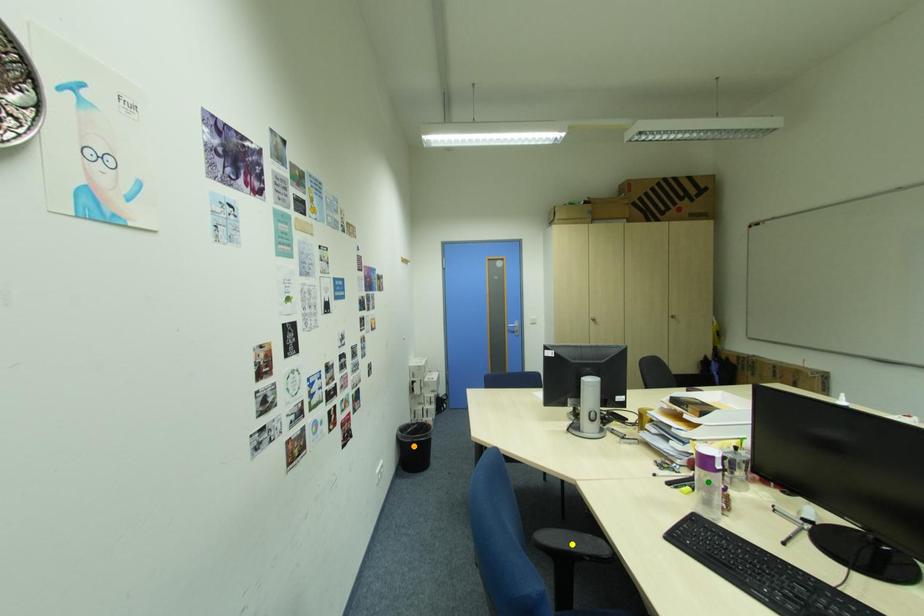
Order these from nearest to farthest:
green point
yellow point
orange point

1. yellow point
2. green point
3. orange point